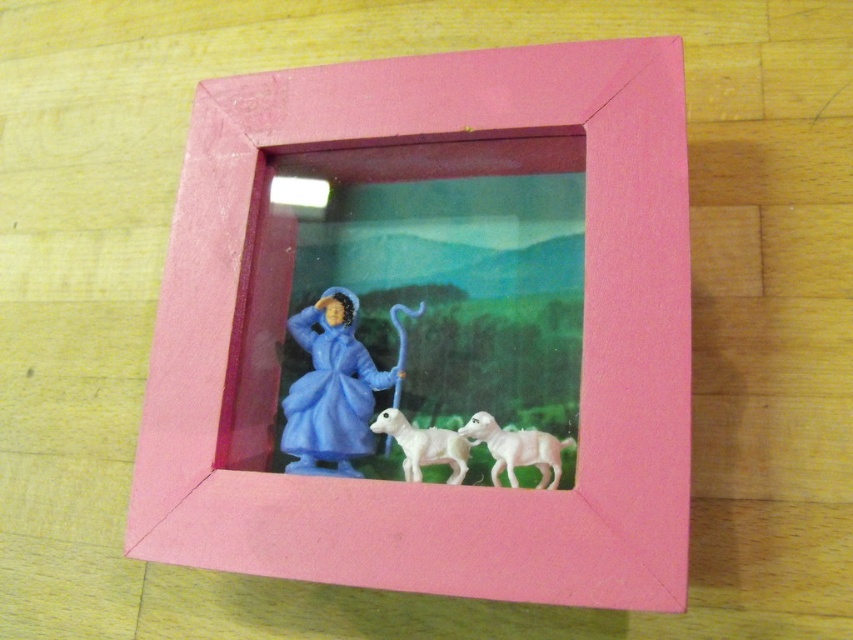
You are an interior designer arranging a shelf and have to place both the white glossy sheep at lower center and the white plastic dog at center. Given their sizes, which one should you place on the left side to maintain balance?

The white glossy sheep at lower center is larger in width than the white plastic dog at center, so placing the larger sheep on the left side would help balance the arrangement by counteracting the visual weight with its greater size.

You are holding a camera and want to take a closeup photo of the white glossy sheep at lower center in the shadow box frame. The camera requires the subject to be at least 70 centimeters away to focus properly. Can you take the photo without moving the sheep?

The distance of the white glossy sheep at lower center from the camera is 69.81 centimeters, which is slightly less than the required 70 centimeters. Therefore, you cannot take the photo without moving the sheep closer to meet the minimum distance requirement.

You are an interior designer arranging a shelf. You have two items to place on the shelf, the white glossy sheep at lower center and the white plastic dog at center. The shelf has a space that can only fit one of them. Based on their sizes, which one should you choose to place on the shelf?

The white glossy sheep at lower center is bigger than the white plastic dog at center, so you should choose the white glossy sheep at lower center to place on the shelf since it requires more space.